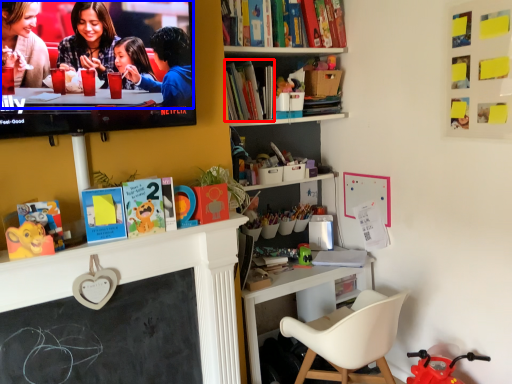
Question: Which point is further to the camera, book (highlighted by a red box) or couple (highlighted by a blue box)?

Choices:
 (A) book
 (B) couple

Answer: (A)